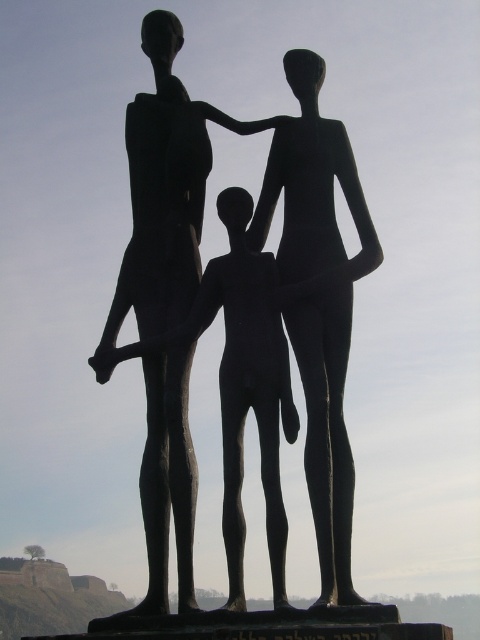
Question: Can you confirm if bronze statue at center is positioned to the right of black matte statue at center?

Choices:
 (A) no
 (B) yes

Answer: (A)

Question: Which of the following is the closest to the observer?

Choices:
 (A) black matte statue at center
 (B) bronze statue at center

Answer: (B)

Question: Which of the following is the farthest from the observer?

Choices:
 (A) black matte statue at center
 (B) bronze statue at center

Answer: (A)

Question: Is bronze statue at center behind black matte statue at center?

Choices:
 (A) yes
 (B) no

Answer: (B)

Question: Does bronze statue at center have a larger size compared to black matte statue at center?

Choices:
 (A) no
 (B) yes

Answer: (B)